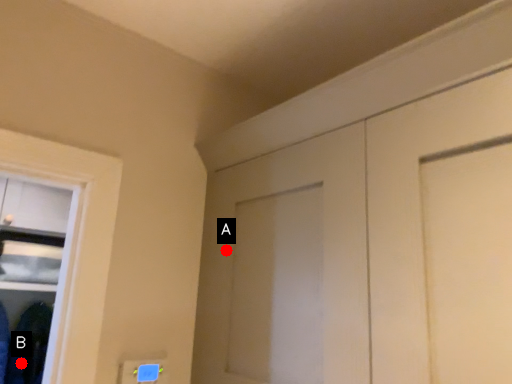
Question: Two points are circled on the image, labeled by A and B beside each circle. Which of the following is the closest to the observer?

Choices:
 (A) A is closer
 (B) B is closer

Answer: (A)